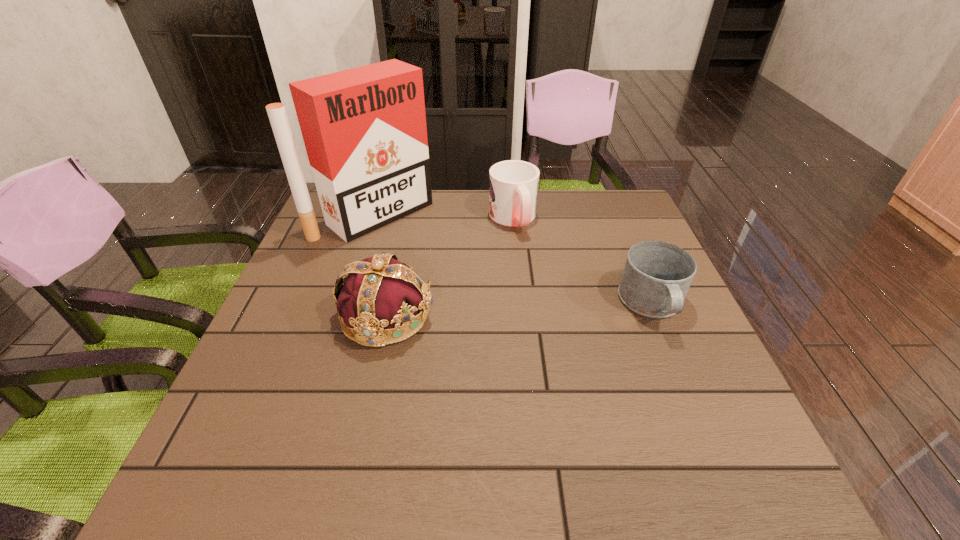
Where is `vacant space situated on the side of the taller mug with the handle`? Image resolution: width=960 pixels, height=540 pixels. vacant space situated on the side of the taller mug with the handle is located at coordinates [x=538, y=272].

The width and height of the screenshot is (960, 540). I want to click on vacant area situated 0.240m on the front-facing side of the cigarette case, so click(x=466, y=276).

Locate an element on the screen. This screenshot has height=540, width=960. vacant space located 0.280m on the front-facing side of the cigarette case is located at coordinates (476, 284).

Locate an element on the screen. vacant space situated on the front-facing side of the cigarette case is located at coordinates (420, 242).

Identify the location of mug present at the far edge. The width and height of the screenshot is (960, 540). (513, 184).

Find the location of a particular element. This screenshot has width=960, height=540. cigarette case present at the far edge is located at coordinates (364, 129).

The image size is (960, 540). I want to click on crown that is at the left edge, so click(x=379, y=293).

Where is `cigarette case at the left edge`? cigarette case at the left edge is located at coordinates (364, 129).

You are a GUI agent. You are given a task and a screenshot of the screen. Output one action in this format:
    pyautogui.click(x=<x>, y=<y>)
    Task: Click on the object present at the right edge
    
    Given the screenshot: What is the action you would take?
    pyautogui.click(x=657, y=275)

In order to click on object that is at the far left corner in this screenshot , I will do `click(364, 129)`.